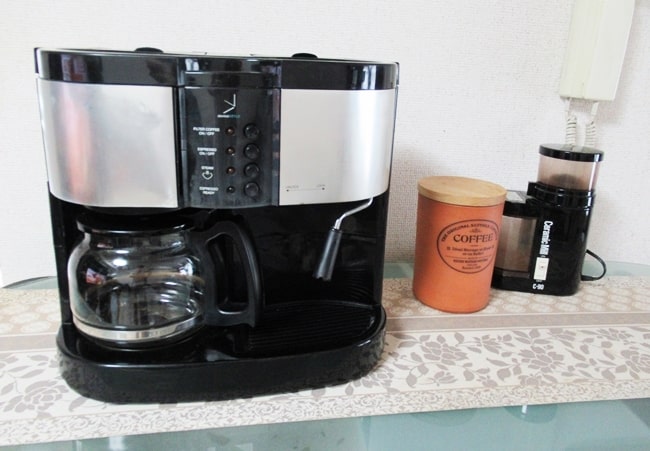
Find the location of a particular element. The width and height of the screenshot is (650, 451). espresso/coffee maker is located at coordinates (123, 152).